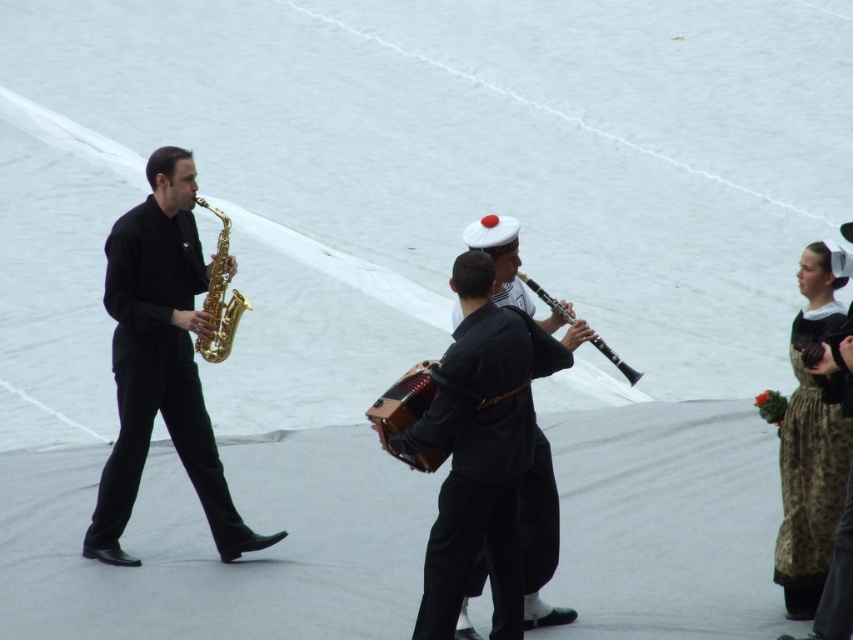
From the picture: Can you confirm if black fabric uniform at center is bigger than shiny gold saxophone at left?

Actually, black fabric uniform at center might be smaller than shiny gold saxophone at left.

Is black fabric uniform at center positioned before shiny gold saxophone at left?

Yes, black fabric uniform at center is in front of shiny gold saxophone at left.

This screenshot has width=853, height=640. Identify the location of black fabric uniform at center. (479, 449).

From the picture: Is brown textured dress at right bigger than gold shiny saxophone at left?

Yes, brown textured dress at right is bigger than gold shiny saxophone at left.

What are the coordinates of `brown textured dress at right` in the screenshot? It's located at (811, 436).

You are a GUI agent. You are given a task and a screenshot of the screen. Output one action in this format:
    pyautogui.click(x=<x>, y=<y>)
    Task: Click on the brown textured dress at right
    This screenshot has width=853, height=640.
    Given the screenshot: What is the action you would take?
    pyautogui.click(x=811, y=436)

Is black fabric uniform at center shorter than brown textured dress at right?

Correct, black fabric uniform at center is not as tall as brown textured dress at right.

Is black fabric uniform at center further to the viewer compared to brown textured dress at right?

No, black fabric uniform at center is closer to the viewer.

The height and width of the screenshot is (640, 853). What do you see at coordinates (479, 449) in the screenshot?
I see `black fabric uniform at center` at bounding box center [479, 449].

Identify the location of black fabric uniform at center. This screenshot has height=640, width=853. (479, 449).